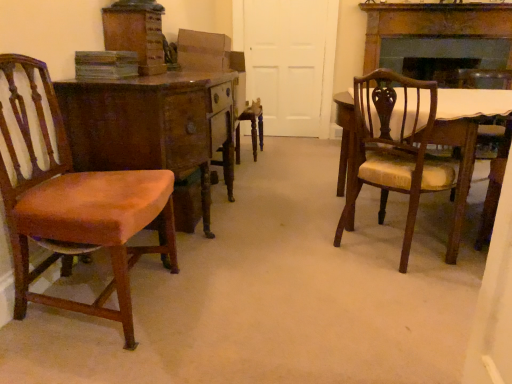
Locate an element on the screen. vacant space in front of matte brown chair at right, positioned as the first chair in right-to-left order is located at coordinates (406, 294).